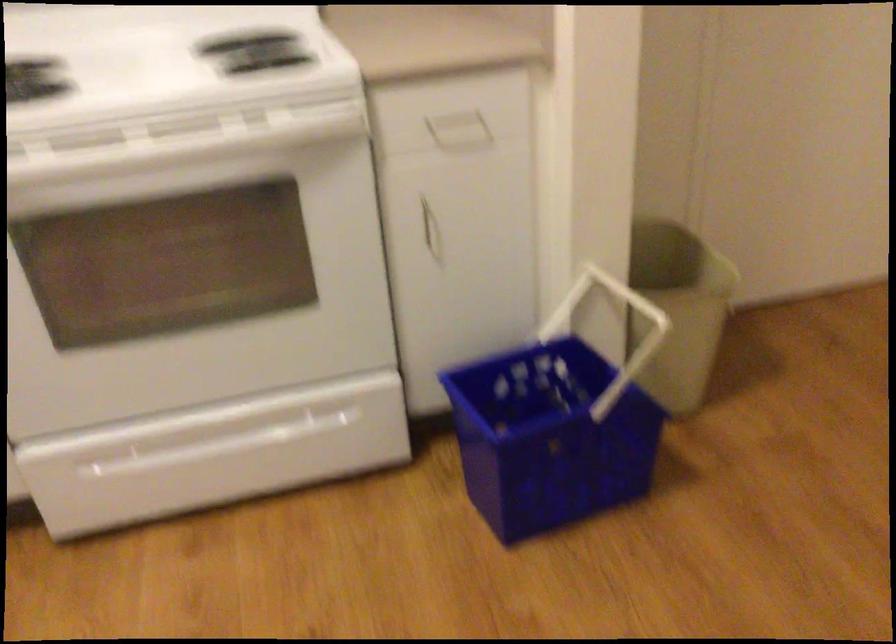
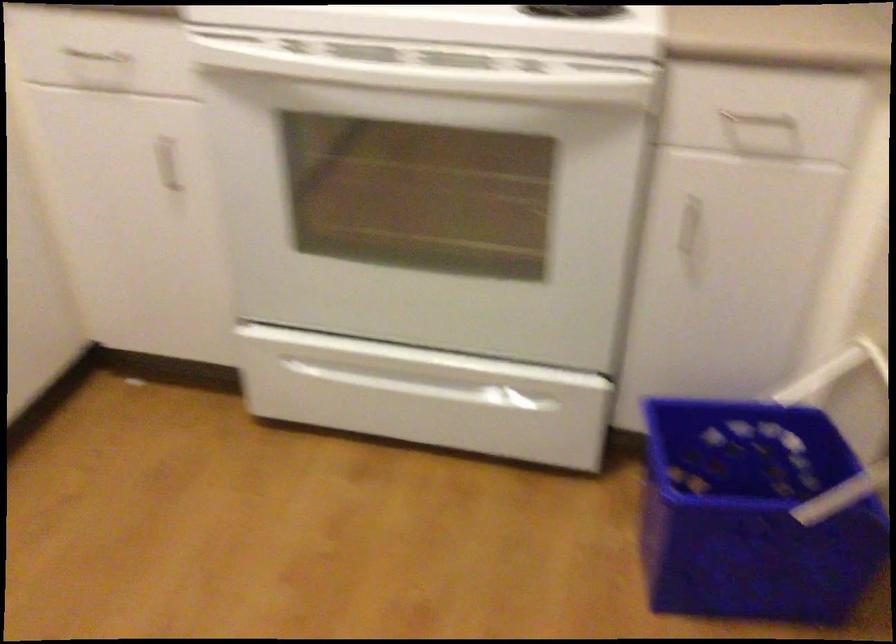
In the second image, find the point that corresponds to (x=246, y=428) in the first image.

(435, 379)